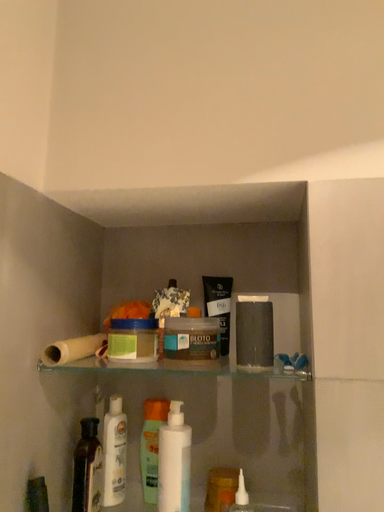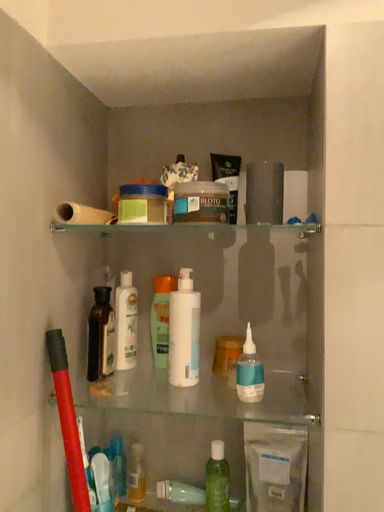
Question: How did the camera likely rotate when shooting the video?

Choices:
 (A) rotated upward
 (B) rotated downward

Answer: (B)